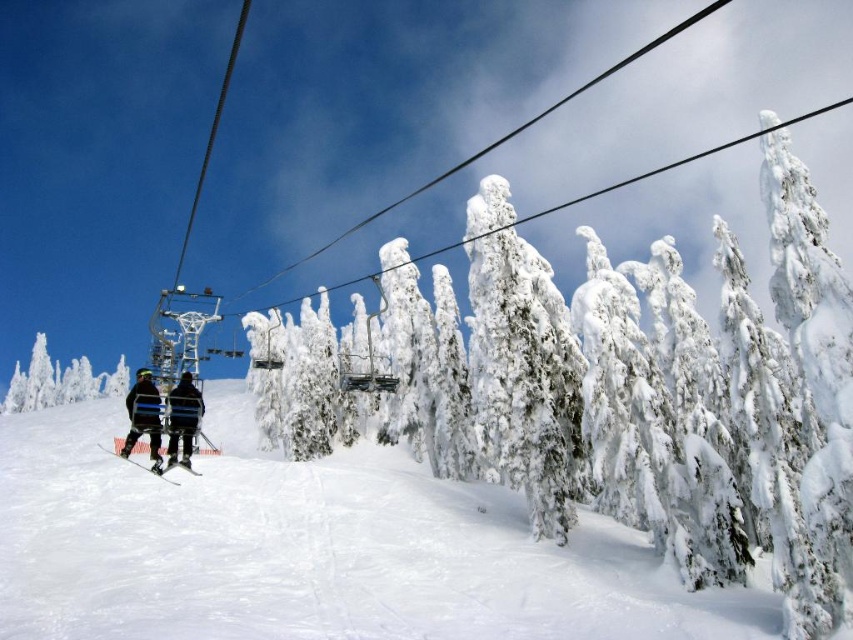
Is white snow ski slope at lower left positioned at the back of white frosty tree at lower left?

No, white snow ski slope at lower left is closer to the viewer.

Measure the distance between white snow ski slope at lower left and white frosty tree at lower left.

The distance of white snow ski slope at lower left from white frosty tree at lower left is 100.89 meters.

Image resolution: width=853 pixels, height=640 pixels. Identify the location of white snow ski slope at lower left. (311, 548).

I want to click on white snow ski slope at lower left, so click(311, 548).

Who is positioned more to the right, white snow ski slope at lower left or black ski suit at center?

black ski suit at center is more to the right.

Does point (184, 605) lie behind point (154, 388)?

Yes, point (184, 605) is behind point (154, 388).

Locate an element on the screen. white snow ski slope at lower left is located at coordinates (311, 548).

Is point (850, 100) less distant than point (158, 476)?

No, it is behind (158, 476).

Is snow-covered evergreen trees at center below black matte skis at lower left?

No.

Who is more distant from viewer, (454, 244) or (189, 472)?

The point (189, 472) is more distant.

Find the location of `snow-covered evergreen trees at center`. snow-covered evergreen trees at center is located at coordinates (630, 180).